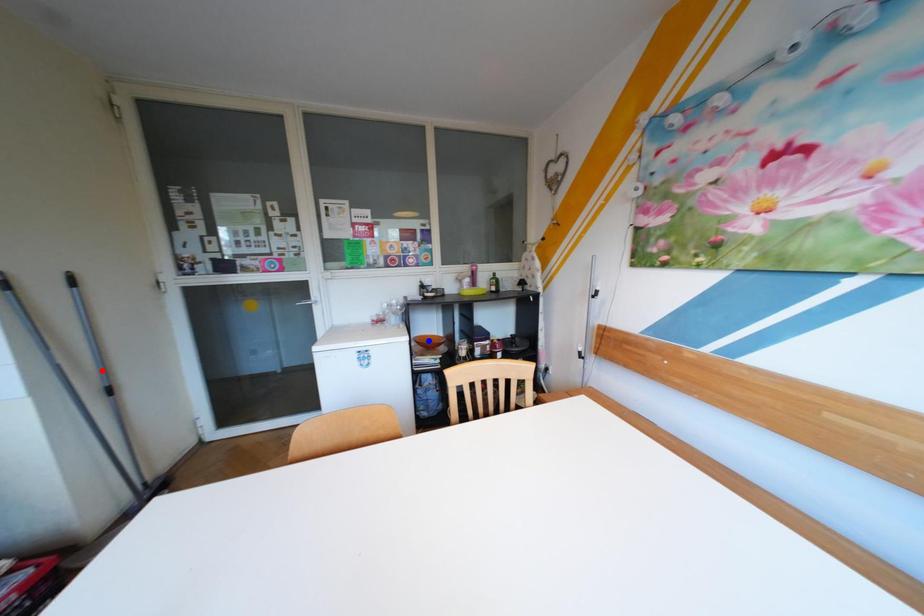
Question: Which of the two points in the image is closer to the camera?

Choices:
 (A) Blue point is closer.
 (B) Red point is closer.

Answer: (B)